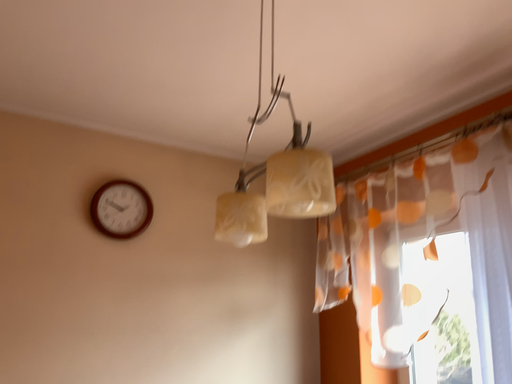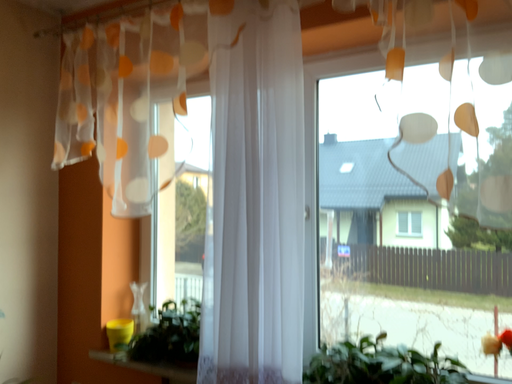
Question: Which way did the camera rotate in the video?

Choices:
 (A) rotated upward
 (B) rotated downward

Answer: (B)